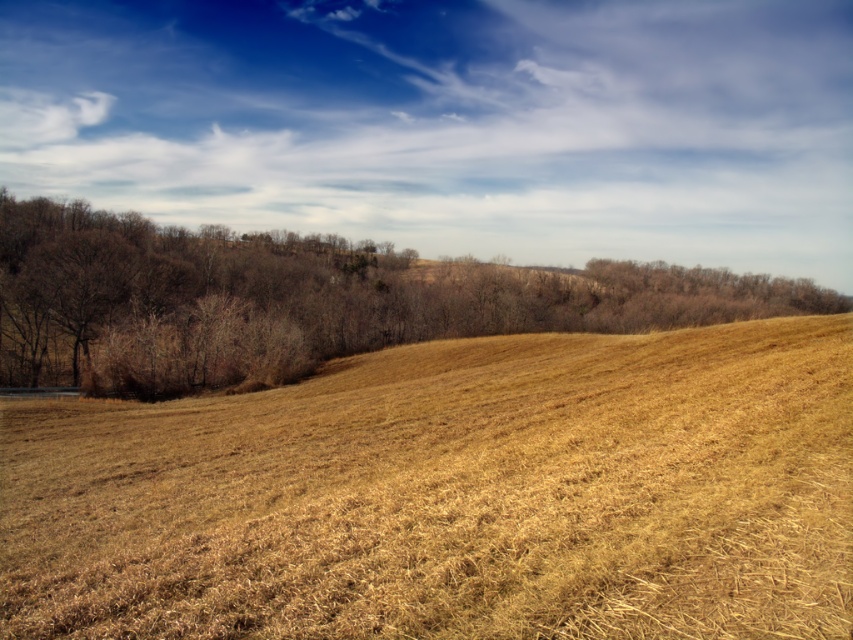
You are standing in the middle of the grassland and notice the dry straw at center. Based on your position, in which direction would you find the dry straw?

The dry straw at center is located at point coordinates, so it is directly in front of you.

You are standing in the middle of a grassland and see the dry straw at center and the brown leafless tree at center. Which object is nearer to you?

The dry straw at center is closer to the viewer than the brown leafless tree at center.

You are a farmer standing at the edge of the field and want to place a scarecrow between the dry straw at center and another object. Which object should you place it between?

The scarecrow should be placed between the dry straw at center and the dense cluster of trees in the midground since they are 4.26 meters apart, providing enough space for the scarecrow.